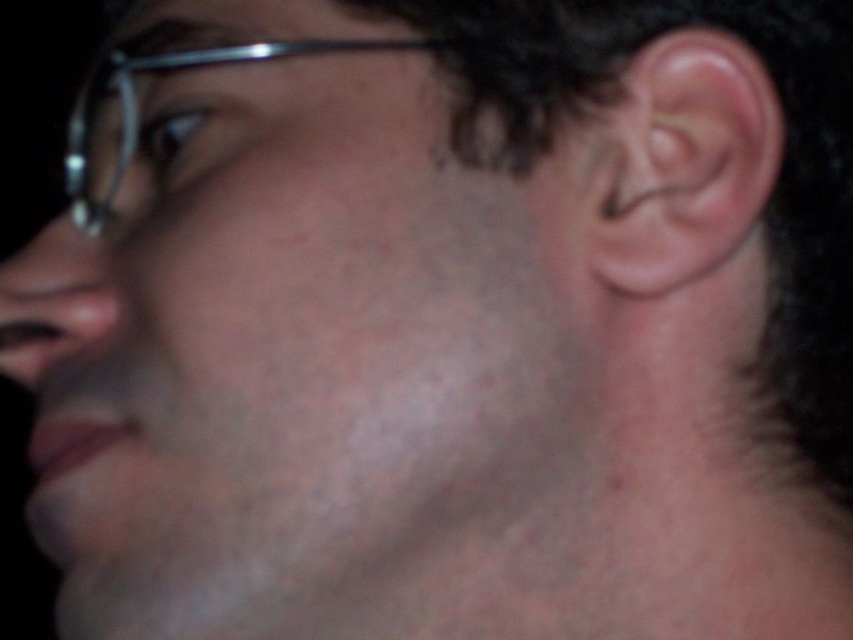
Is point (724, 145) farther from camera compared to point (184, 52)?

No.

Where is `pinkish skin ear at right`? The width and height of the screenshot is (853, 640). pinkish skin ear at right is located at coordinates (676, 163).

Locate an element on the screen. Image resolution: width=853 pixels, height=640 pixels. pinkish skin ear at right is located at coordinates (676, 163).

I want to click on pinkish skin ear at right, so click(676, 163).